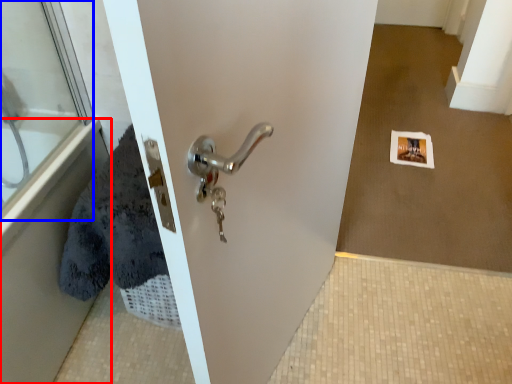
Question: Which object is further to the camera taking this photo, bath (highlighted by a red box) or glass door (highlighted by a blue box)?

Choices:
 (A) bath
 (B) glass door

Answer: (B)